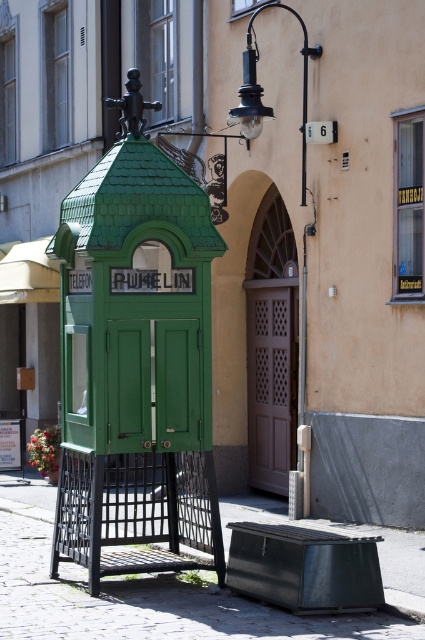
Who is lower down, green metal bench at lower center or matte black lamp post at upper right?

green metal bench at lower center

Is green metal bench at lower center thinner than matte black lamp post at upper right?

Indeed, green metal bench at lower center has a lesser width compared to matte black lamp post at upper right.

Between point (175, 598) and point (240, 129), which one is positioned behind?

Point (240, 129)

The height and width of the screenshot is (640, 425). What are the coordinates of `green metal bench at lower center` in the screenshot? It's located at [x=146, y=602].

Who is taller, green matte telephone booth at center or green metal bench at lower center?

Standing taller between the two is green matte telephone booth at center.

Who is lower down, green matte telephone booth at center or green metal bench at lower center?

green metal bench at lower center is below.

You are a GUI agent. You are given a task and a screenshot of the screen. Output one action in this format:
    pyautogui.click(x=<x>, y=<y>)
    Task: Click on the green matte telephone booth at center
    The height and width of the screenshot is (640, 425).
    Given the screenshot: What is the action you would take?
    pyautogui.click(x=136, y=358)

Is green matte telephone booth at center wider than matte black lamp post at upper right?

Yes, green matte telephone booth at center is wider than matte black lamp post at upper right.

Does green matte telephone booth at center have a greater height compared to matte black lamp post at upper right?

Correct, green matte telephone booth at center is much taller as matte black lamp post at upper right.

The height and width of the screenshot is (640, 425). In order to click on green matte telephone booth at center in this screenshot , I will do pos(136,358).